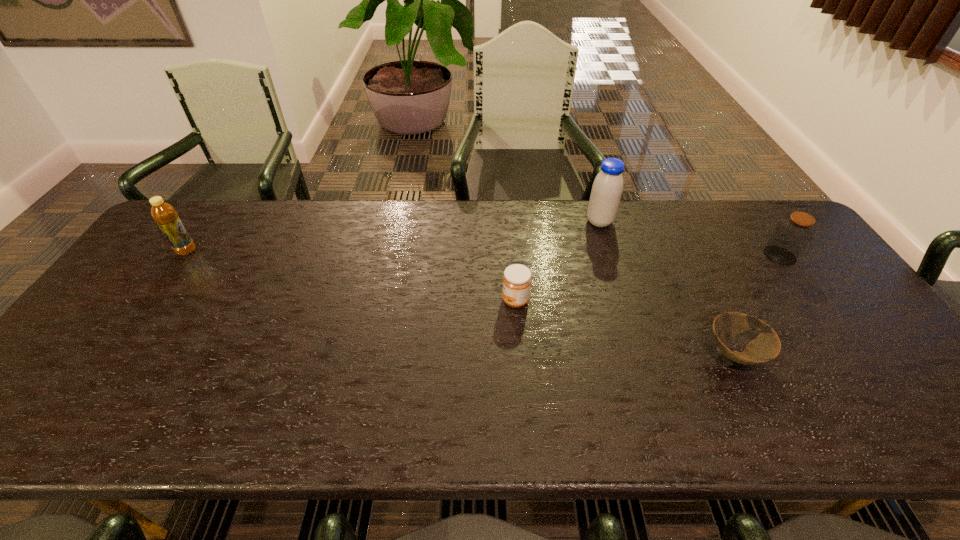
The image size is (960, 540). What are the coordinates of `soya milk` in the screenshot? It's located at (607, 188).

You are a GUI agent. You are given a task and a screenshot of the screen. Output one action in this format:
    pyautogui.click(x=<x>, y=<y>)
    Task: Click on the third object from left to right
    The height and width of the screenshot is (540, 960).
    Given the screenshot: What is the action you would take?
    pyautogui.click(x=607, y=188)

Where is `the leftmost object`? Image resolution: width=960 pixels, height=540 pixels. the leftmost object is located at coordinates (164, 214).

Where is `bottle`? This screenshot has width=960, height=540. bottle is located at coordinates (164, 214).

This screenshot has height=540, width=960. I want to click on the third shortest object, so click(x=792, y=235).

Where is `jar`? This screenshot has height=540, width=960. jar is located at coordinates (792, 235).

Find the location of `the second nearest object`. the second nearest object is located at coordinates (517, 279).

Where is `the second shortest object`? Image resolution: width=960 pixels, height=540 pixels. the second shortest object is located at coordinates 517,279.

Find the location of a particular element. This screenshot has width=960, height=540. bowl is located at coordinates (766, 346).

The image size is (960, 540). I want to click on the fourth object from left to right, so click(x=766, y=346).